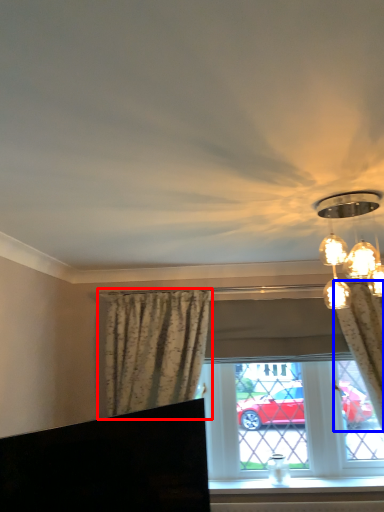
Question: Which object appears farthest to the camera in this image, curtain (highlighted by a red box) or curtain (highlighted by a blue box)?

Choices:
 (A) curtain
 (B) curtain

Answer: (A)